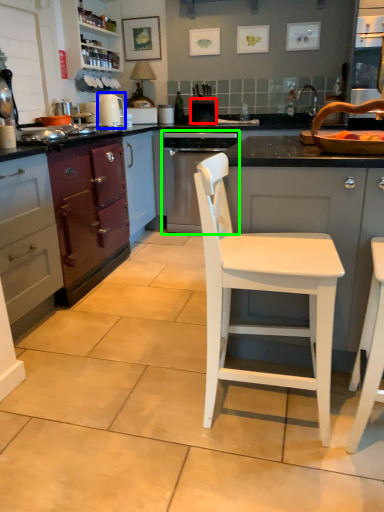
Question: Considering the real-world distances, which object is farthest from appliance (highlighted by a red box)? kitchen appliance (highlighted by a blue box) or home appliance (highlighted by a green box)?

Choices:
 (A) kitchen appliance
 (B) home appliance

Answer: (A)